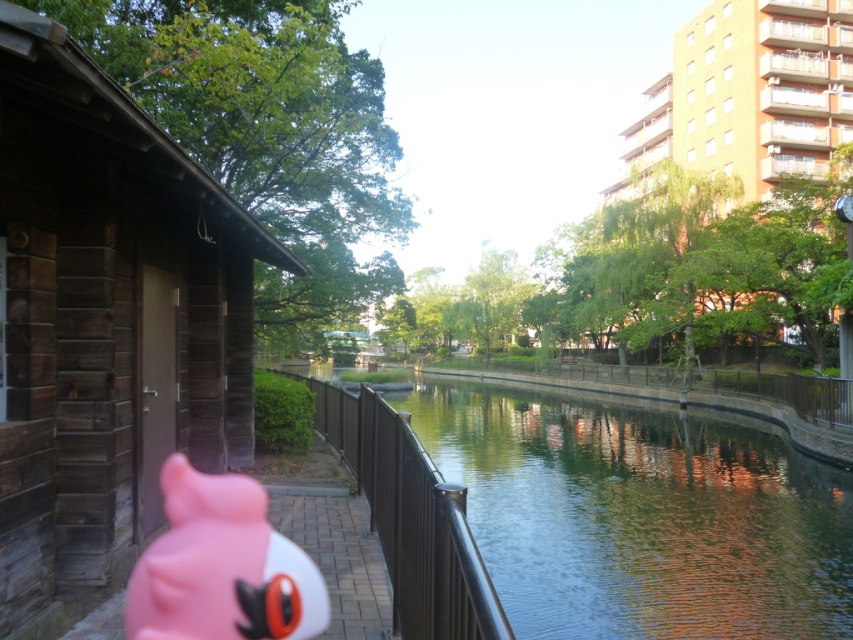
Does pink rubber duck at lower left have a smaller size compared to black metal/rail at center?

Correct, pink rubber duck at lower left occupies less space than black metal/rail at center.

The image size is (853, 640). Describe the element at coordinates (221, 566) in the screenshot. I see `pink rubber duck at lower left` at that location.

This screenshot has width=853, height=640. Identify the location of pink rubber duck at lower left. (221, 566).

Who is more forward, (x=503, y=432) or (x=437, y=632)?

Point (x=437, y=632)

Describe the element at coordinates (641, 516) in the screenshot. I see `green reflective water at center` at that location.

Locate an element on the screen. green reflective water at center is located at coordinates (641, 516).

Between green reflective water at center and pink rubber duck at lower left, which one appears on the left side from the viewer's perspective?

pink rubber duck at lower left is more to the left.

Is green reflective water at center thinner than pink rubber duck at lower left?

Incorrect, green reflective water at center's width is not less than pink rubber duck at lower left's.

Which is behind, point (576, 403) or point (288, 548)?

Positioned behind is point (576, 403).

The height and width of the screenshot is (640, 853). What are the coordinates of `green reflective water at center` in the screenshot? It's located at (641, 516).